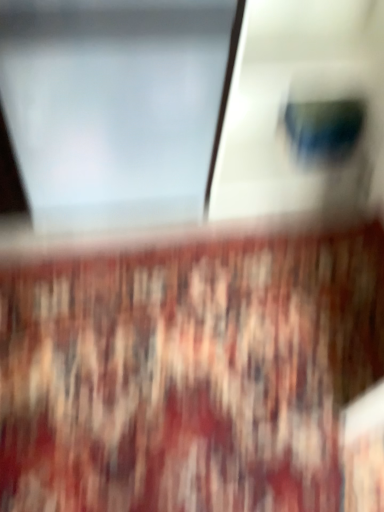
Question: Should I look upward or downward to see carpeted mat at center?

Choices:
 (A) down
 (B) up

Answer: (A)